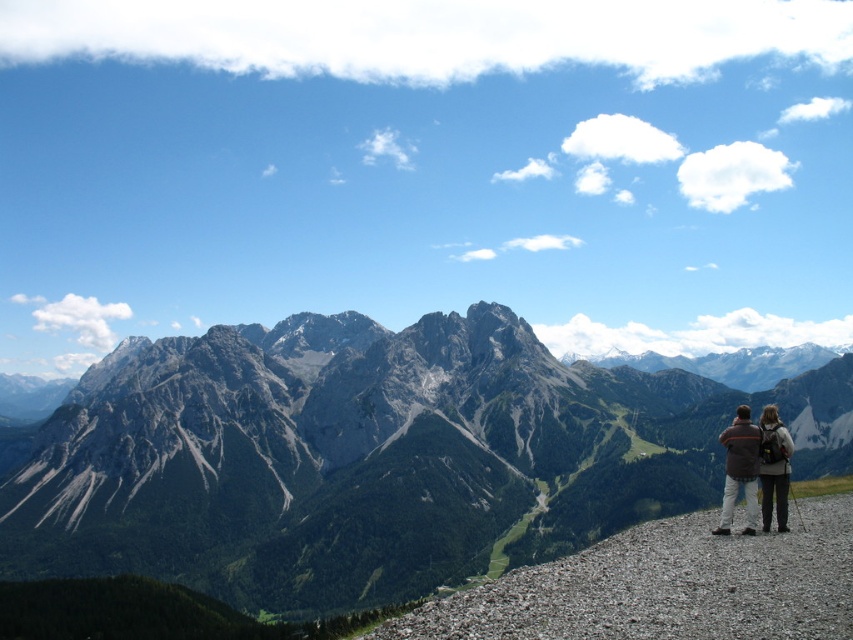
You are standing at the starting point of a hiking trail and see the gray rocky mountain range at center. If you want to reach the mountain range, which direction should you walk relative to your current position?

The gray rocky mountain range at center is located at coordinates point (369, 458), so you should walk towards the center of the image to reach it.

You are a hiker standing on the gravelly path and want to take a photo of the gray rocky mountain range at center. Since your camera has a limited zoom, will you need to move closer to the mountain range to include the dark gray backpack at lower right in the photo?

The gray rocky mountain range at center is taller than the dark gray backpack at lower right. Therefore, you can capture both in the photo without moving closer because the mountain range is higher and will naturally appear in the background alongside the backpack.